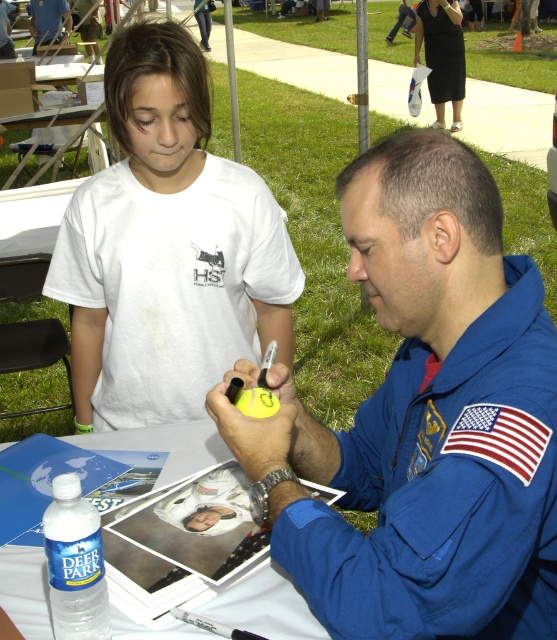
Question: Where is white paper at center located in relation to blue space suit at center in the image?

Choices:
 (A) left
 (B) right

Answer: (B)

Question: Which object is positioned farthest from the white paper at center?

Choices:
 (A) white cotton shirt at upper left
 (B) blue space suit at center
 (C) blue fabric astronaut suit at center

Answer: (B)

Question: Can you confirm if blue fabric astronaut suit at center is positioned below white cotton shirt at upper left?

Choices:
 (A) no
 (B) yes

Answer: (B)

Question: Is white cotton shirt at upper left to the right of blue space suit at center from the viewer's perspective?

Choices:
 (A) no
 (B) yes

Answer: (B)

Question: Among these points, which one is nearest to the camera?

Choices:
 (A) (173, 456)
 (B) (41, 22)

Answer: (A)

Question: Which of these objects is positioned closest to the white paper at center?

Choices:
 (A) white cotton shirt at upper left
 (B) blue space suit at center
 (C) blue fabric astronaut suit at center

Answer: (A)